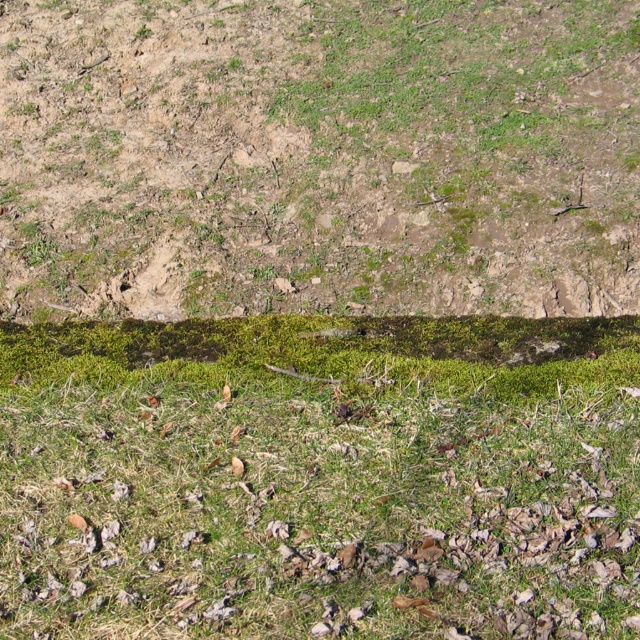
You are standing at the green mossy soil at center and want to move to the green grassy at lower center. Which direction should you walk to reach your destination?

The green grassy at lower center is to the right of the green mossy soil at center, so you should walk to the right to reach it.

You are a drone operator trying to land a drone on the ground. The drone is currently hovering above the two points marked as point (564,422) and point (529,196). Which point should you choose to land the drone if you want to land closer to the camera?

You should choose point (564,422) to land the drone because it is closer to the camera than point (529,196).

You are a gardener trying to plant a new flower bed. You need to choose between the green grassy at lower center and the green mossy soil at center. Which area is closer to the ground surface?

The green grassy at lower center is positioned under the green mossy soil at center, so the green grassy at lower center is closer to the ground surface.